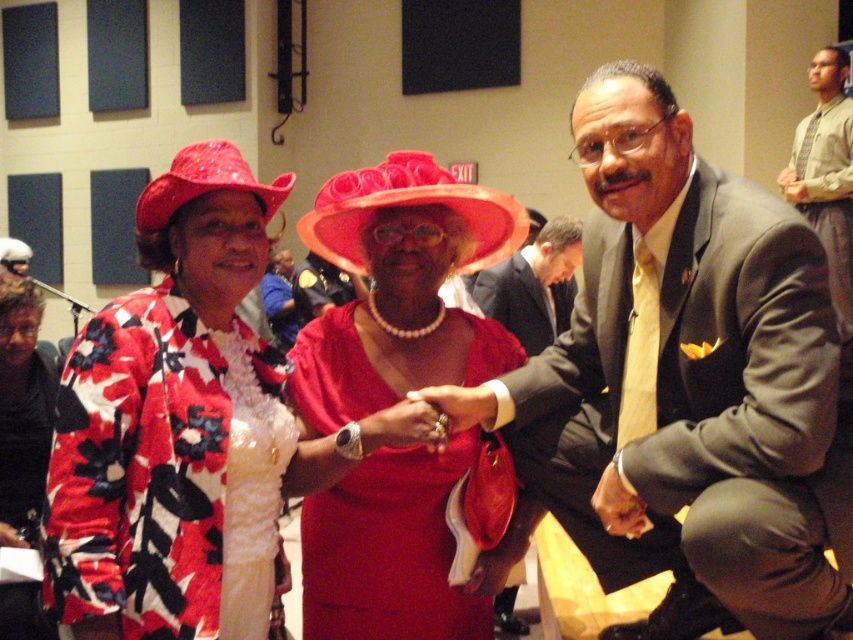
You are a photographer setting up for a group photo. You have to ensure that the black satin dress at lower left and the matte red hat at center are both visible in the frame. Considering their sizes, which object might require you to adjust your camera angle to include it properly?

The black satin dress at lower left has a greater height compared to the matte red hat at center, so you might need to adjust the camera angle to accommodate its taller size to ensure it fits within the frame.